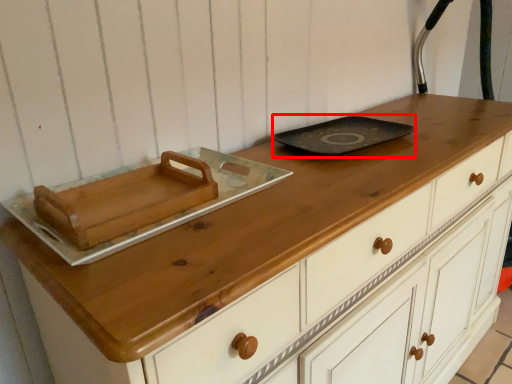
Question: Where is frying pan (annotated by the red box) located in relation to food in the image?

Choices:
 (A) right
 (B) left

Answer: (A)